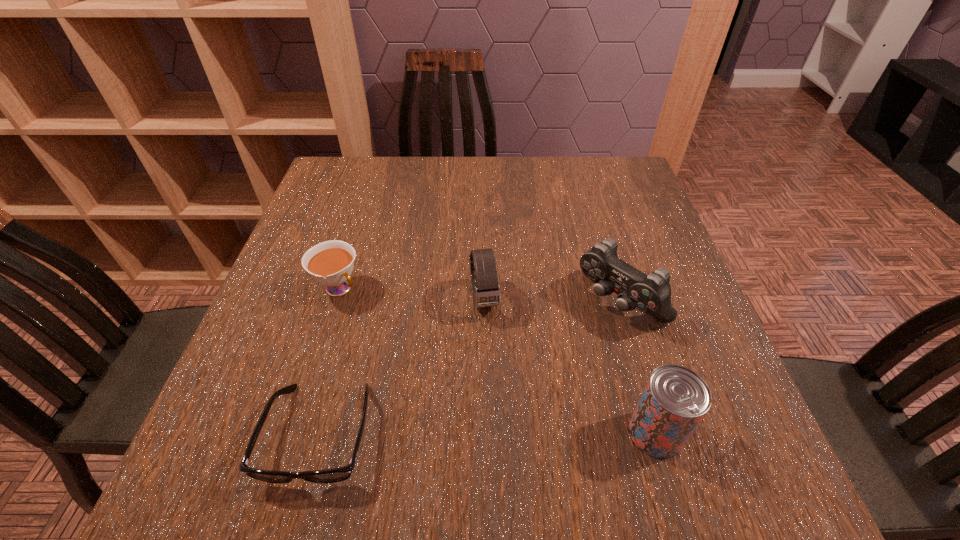
At what (x,y) coordinates should I click in order to perform the action: click on empty space that is in between the spectacles and the watch. Please return your answer as a coordinate pair (x, y). This screenshot has width=960, height=540. Looking at the image, I should click on (402, 366).

Locate an element on the screen. Image resolution: width=960 pixels, height=540 pixels. empty location between the control and the watch is located at coordinates (552, 300).

Find the location of a particular element. The width and height of the screenshot is (960, 540). free space between the teacup and the shortest object is located at coordinates (x=329, y=361).

Where is `vacant area that lies between the beer can and the spectacles`? This screenshot has width=960, height=540. vacant area that lies between the beer can and the spectacles is located at coordinates (488, 433).

Find the location of a particular element. The image size is (960, 540). vacant region between the watch and the control is located at coordinates (552, 300).

Locate an element on the screen. Image resolution: width=960 pixels, height=540 pixels. free spot between the spectacles and the beer can is located at coordinates (488, 433).

At what (x,y) coordinates should I click in order to perform the action: click on empty space between the beer can and the teacup. Please return your answer as a coordinate pair (x, y). Looking at the image, I should click on (496, 361).

Identify the location of vacant area that lies between the watch and the beer can. (569, 366).

Where is `vacant space that's between the control and the watch`? The width and height of the screenshot is (960, 540). vacant space that's between the control and the watch is located at coordinates (552, 300).

In order to click on object that is the nearest to the second shortest object in this screenshot , I will do `click(340, 474)`.